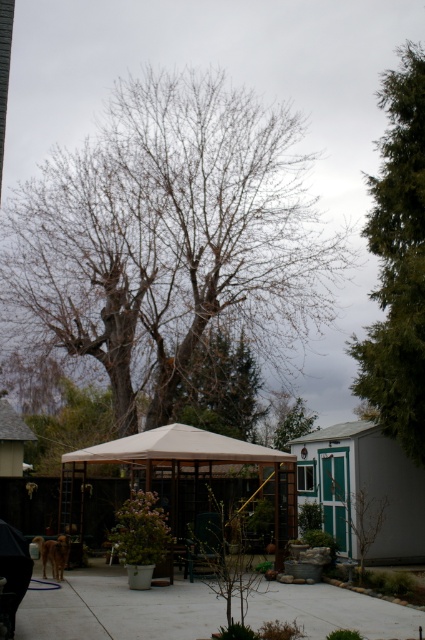
In the scene shown: Who is more forward, (422,365) or (257,595)?

Point (257,595)

Does green textured evergreen tree at right lie in front of gray concrete pavement at lower center?

No, it is not.

Does point (421, 298) come farther from viewer compared to point (132, 614)?

Yes, point (421, 298) is farther from viewer.

You are a GUI agent. You are given a task and a screenshot of the screen. Output one action in this format:
    pyautogui.click(x=<x>, y=<y>)
    Task: Click on the green textured evergreen tree at right
    Image resolution: width=425 pixels, height=640 pixels.
    Given the screenshot: What is the action you would take?
    pyautogui.click(x=397, y=262)

Between point (90, 218) and point (121, 456), which one is positioned in front?

Point (121, 456) is in front.

Is point (268, 163) less distant than point (238, 461)?

No, (268, 163) is further to viewer.

You are a GUI agent. You are given a task and a screenshot of the screen. Output one action in this format:
    pyautogui.click(x=<x>, y=<y>)
    Task: Click on the bare branches at center
    Image resolution: width=425 pixels, height=640 pixels.
    Given the screenshot: What is the action you would take?
    pyautogui.click(x=170, y=237)

Is gray concrete pavement at lower center to the right of beige fabric canopy at center from the viewer's perspective?

Yes, gray concrete pavement at lower center is to the right of beige fabric canopy at center.

Who is more forward, (59,588) or (98,445)?

Point (59,588) is in front.

The image size is (425, 640). Describe the element at coordinates (118, 609) in the screenshot. I see `gray concrete pavement at lower center` at that location.

Identify the location of gray concrete pavement at lower center. (118, 609).